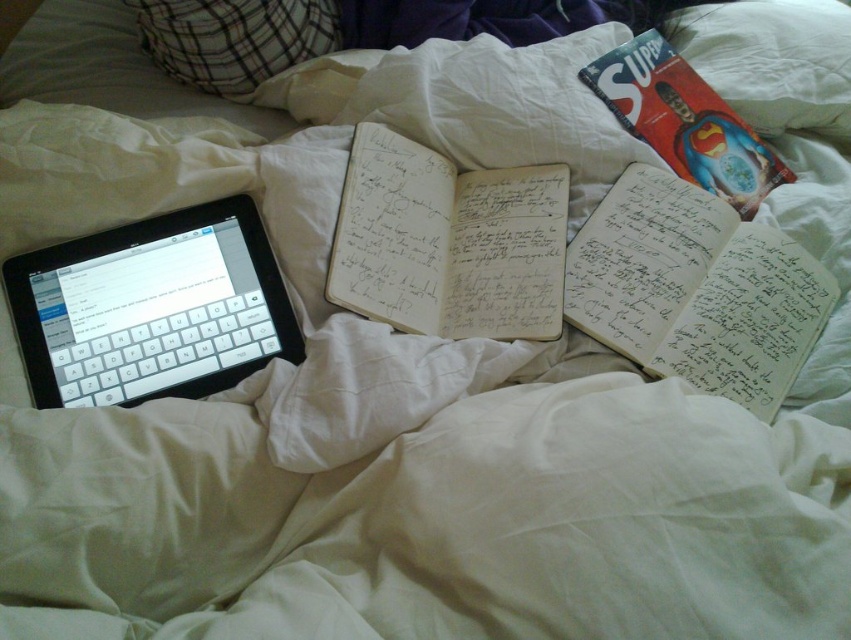
Is the position of white soft pillow at upper right less distant than that of plaid fabric pillow at upper left?

That is False.

Who is more forward, [844,8] or [271,36]?

Positioned in front is point [271,36].

The width and height of the screenshot is (851, 640). Find the location of `white soft pillow at upper right`. white soft pillow at upper right is located at coordinates (774, 60).

Does point (174, 339) come behind point (610, 196)?

No, (174, 339) is closer to viewer.

Looking at this image, does black matte tablet at left have a smaller size compared to white paper journal at center right?

Yes, black matte tablet at left is smaller than white paper journal at center right.

Is point (33, 387) behind point (780, 371)?

No, (33, 387) is in front of (780, 371).

Locate an element on the screen. This screenshot has width=851, height=640. black matte tablet at left is located at coordinates (151, 308).

Who is shorter, superman comic book at upper right or plaid fabric pillow at upper left?

With less height is plaid fabric pillow at upper left.

Who is higher up, superman comic book at upper right or plaid fabric pillow at upper left?

plaid fabric pillow at upper left is higher up.

Locate an element on the screen. superman comic book at upper right is located at coordinates (684, 122).

Image resolution: width=851 pixels, height=640 pixels. I want to click on superman comic book at upper right, so (x=684, y=122).